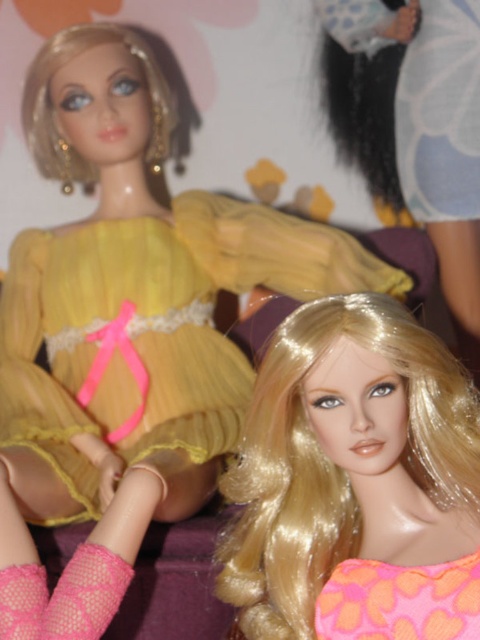
Question: Among these points, which one is farthest from the camera?

Choices:
 (A) (431, 346)
 (B) (446, 616)

Answer: (A)

Question: Which object is closer to the camera taking this photo?

Choices:
 (A) shiny blonde wig at center
 (B) yellow sheer dress at upper left
 (C) pink fabric dress at lower right

Answer: (A)

Question: From the image, what is the correct spatial relationship of shiny blonde wig at center in relation to yellow sheer dress at upper left?

Choices:
 (A) below
 (B) above

Answer: (A)

Question: Does shiny blonde wig at center appear under pink fabric dress at lower right?

Choices:
 (A) yes
 (B) no

Answer: (B)

Question: Considering the real-world distances, which object is closest to the shiny blonde wig at center?

Choices:
 (A) yellow sheer dress at upper left
 (B) pink fabric dress at lower right

Answer: (B)

Question: Does shiny blonde wig at center appear on the left side of yellow sheer dress at upper left?

Choices:
 (A) yes
 (B) no

Answer: (B)